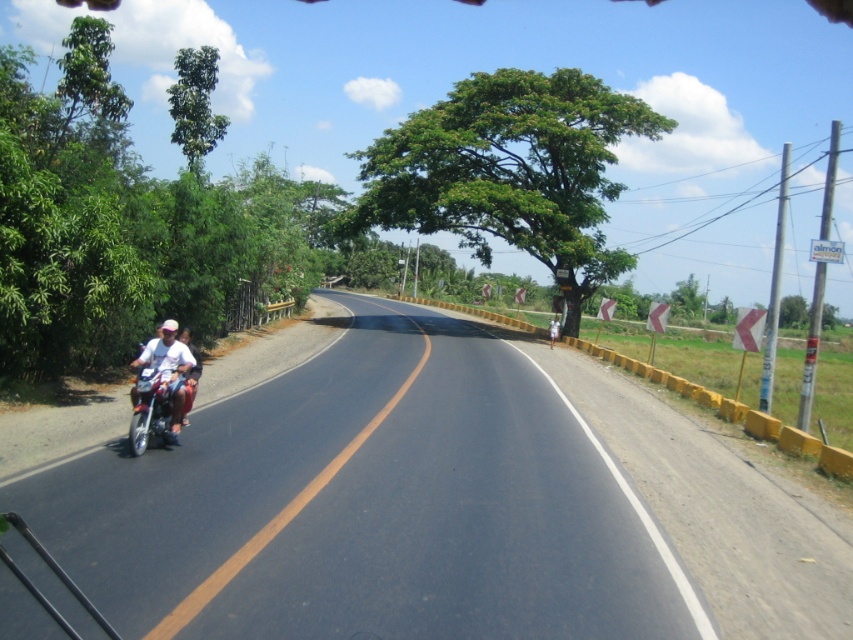
You are a pedestrian standing at the edge of the black asphalt road at left. You see the white matte motorcycle at left approaching from behind. If the motorcycle is moving at 15 km per hour, will you have enough time to cross the road safely before it reaches your position?

The black asphalt road at left is 5.24 meters away from the white matte motorcycle at left. At 15 km per hour, the motorcycle will take approximately 1.3 seconds to cover the distance. Since this is a very short time, it is not safe to cross the road before the motorcycle reaches your position.

You are a delivery driver who needs to pass between the metallic silver motorcycle at left and the white matte motorcycle at left on a narrow road. Your delivery vehicle is 3 feet wide. Can you safely navigate through the gap between them?

The gap between the metallic silver motorcycle at left and the white matte motorcycle at left is 36.54 inches. Since 36.54 inches is equal to 3.045 feet, which is slightly wider than the delivery vehicle width of 3 feet, you can safely pass through the gap between the metallic silver motorcycle at left and the white matte motorcycle at left.